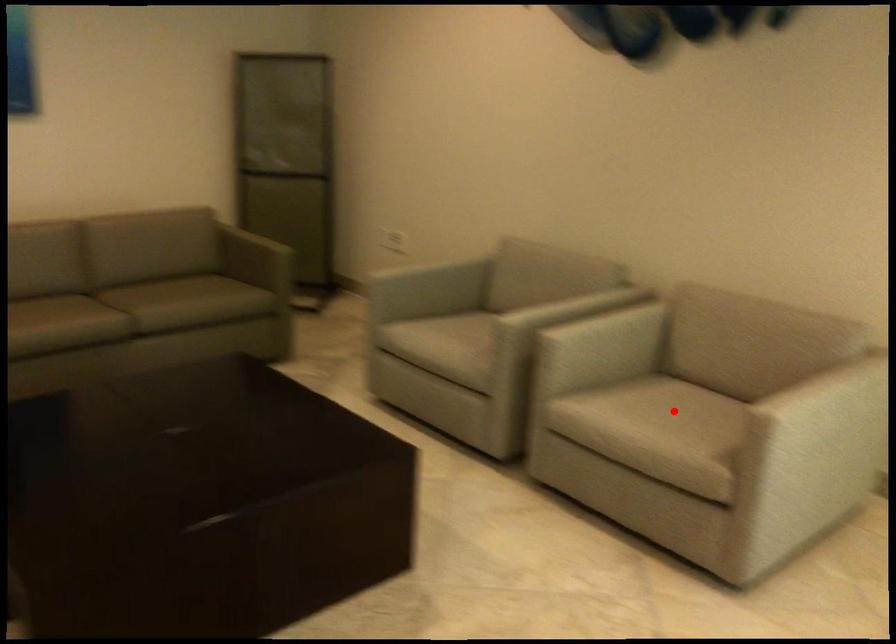
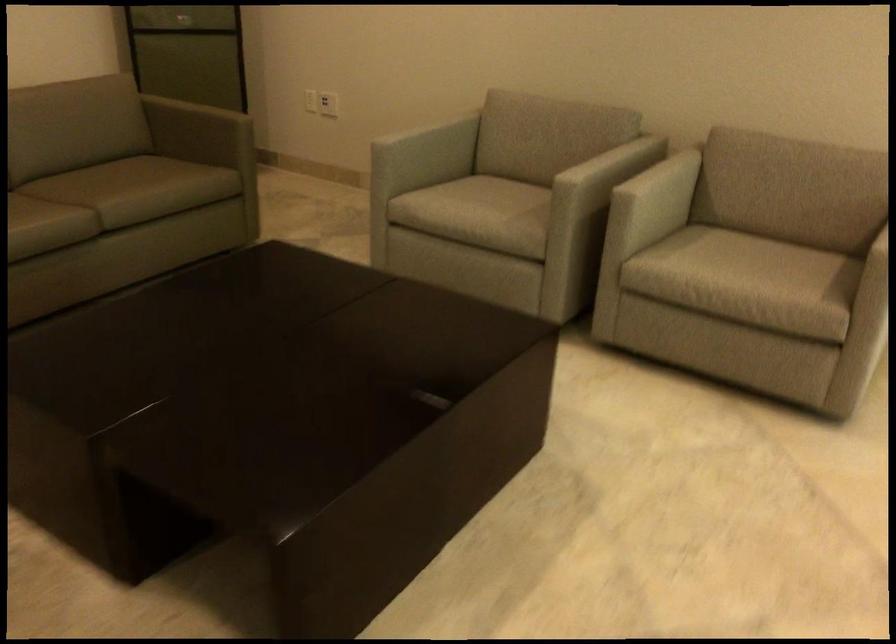
Find the pixel in the second image that matches the highlighted location in the first image.

(739, 257)